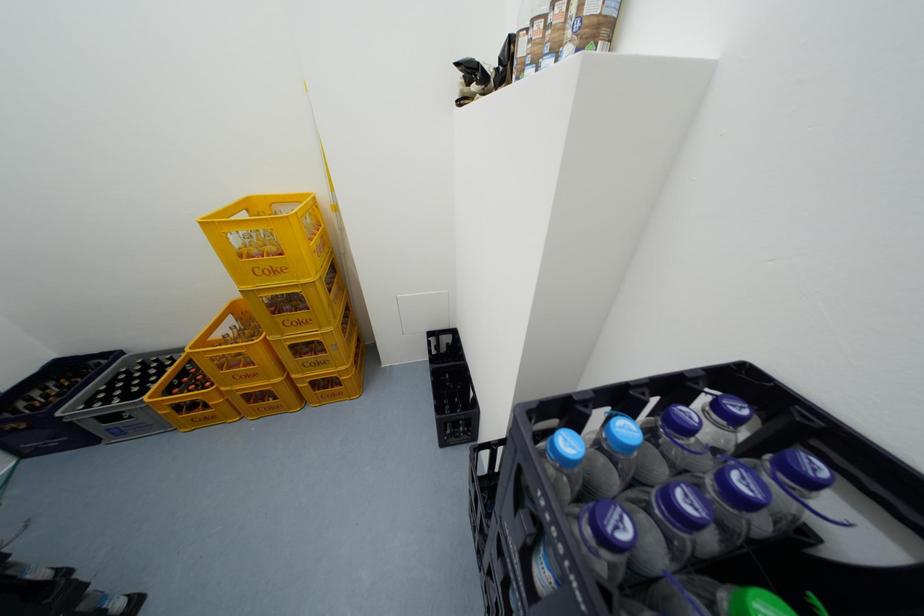
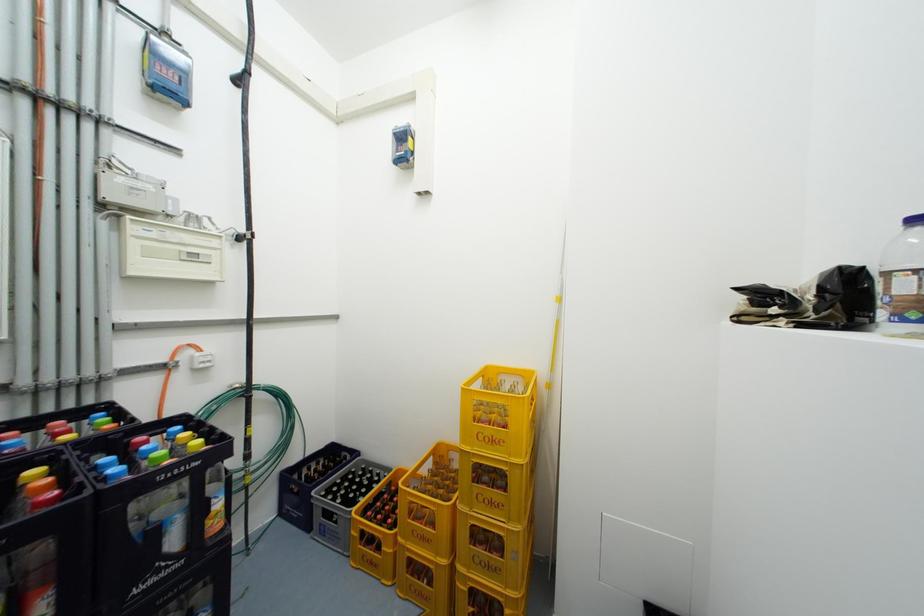
Consider the image. First-person continuous shooting, in which direction is the camera rotating?

The rotation direction of the camera is left-up.